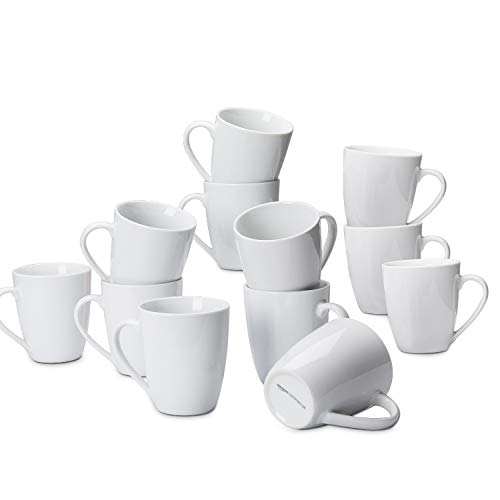
Find the location of `stacked mugs`. stacked mugs is located at coordinates (111, 299), (143, 246), (226, 199), (244, 152), (289, 248), (286, 317), (369, 249), (373, 187).